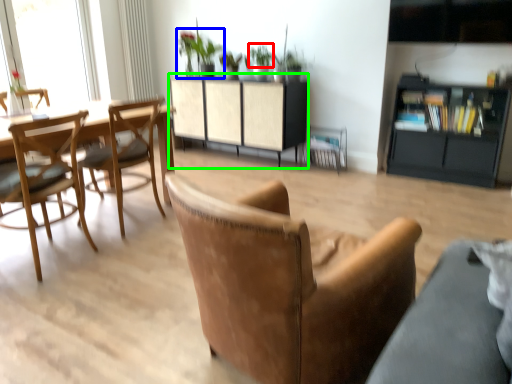
Question: Which is farther away from plant (highlighted by a red box)? houseplant (highlighted by a blue box) or cabinetry (highlighted by a green box)?

Choices:
 (A) houseplant
 (B) cabinetry

Answer: (B)